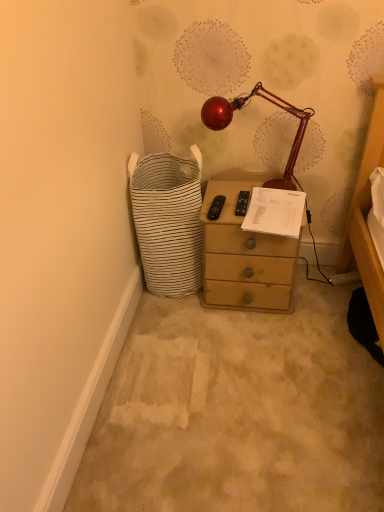
Find the location of a particular element. Image resolution: width=384 pixels, height=512 pixels. space that is in front of matte brown chest of drawers at center is located at coordinates tap(256, 347).